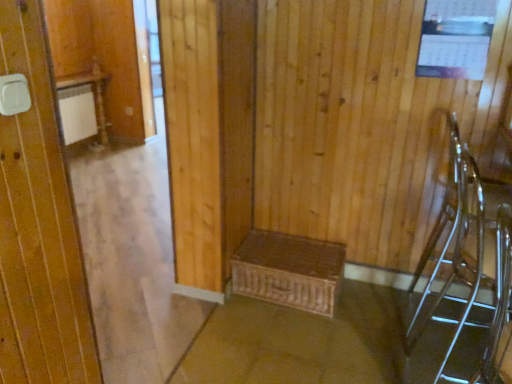
Question: Is the position of woven brown chest at center more distant than that of clear glass armchair at right, which appears as the first armchair when viewed from the back?

Choices:
 (A) yes
 (B) no

Answer: (A)

Question: Is woven brown chest at center facing towards clear glass armchair at right, the 2th armchair positioned from the front?

Choices:
 (A) no
 (B) yes

Answer: (A)

Question: From a real-world perspective, is woven brown chest at center under clear glass armchair at right, the 2th armchair positioned from the front?

Choices:
 (A) no
 (B) yes

Answer: (B)

Question: Does woven brown chest at center appear on the left side of clear glass armchair at right, which appears as the first armchair when viewed from the back?

Choices:
 (A) yes
 (B) no

Answer: (A)

Question: Is woven brown chest at center bigger than clear glass armchair at right, the 2th armchair positioned from the front?

Choices:
 (A) no
 (B) yes

Answer: (A)

Question: From the image's perspective, is woven brown chest at center above or below brown woven basket at lower center?

Choices:
 (A) below
 (B) above

Answer: (B)

Question: Is woven brown chest at center inside or outside of brown woven basket at lower center?

Choices:
 (A) inside
 (B) outside

Answer: (B)

Question: In terms of height, does woven brown chest at center look taller or shorter compared to brown woven basket at lower center?

Choices:
 (A) short
 (B) tall

Answer: (B)

Question: In terms of width, does woven brown chest at center look wider or thinner when compared to brown woven basket at lower center?

Choices:
 (A) thin
 (B) wide

Answer: (A)

Question: Visually, is clear glass armchair at right, the 2th armchair positioned from the front, positioned to the left or to the right of brown woven basket at lower center?

Choices:
 (A) left
 (B) right

Answer: (B)

Question: Considering their positions, is clear glass armchair at right, which appears as the first armchair when viewed from the back, located in front of or behind brown woven basket at lower center?

Choices:
 (A) front
 (B) behind

Answer: (A)

Question: From a real-world perspective, is clear glass armchair at right, which appears as the first armchair when viewed from the back, physically located above or below brown woven basket at lower center?

Choices:
 (A) below
 (B) above

Answer: (B)

Question: Is point (463, 180) closer or farther from the camera than point (249, 324)?

Choices:
 (A) farther
 (B) closer

Answer: (B)

Question: From the image's perspective, relative to clear plastic chair at right, which appears as the 2th armchair when viewed from the back, is brown woven basket at lower center above or below?

Choices:
 (A) below
 (B) above

Answer: (A)

Question: Considering the positions of brown woven basket at lower center and clear plastic chair at right, which is the 1th armchair in front-to-back order, in the image, is brown woven basket at lower center taller or shorter than clear plastic chair at right, which is the 1th armchair in front-to-back order,?

Choices:
 (A) short
 (B) tall

Answer: (A)